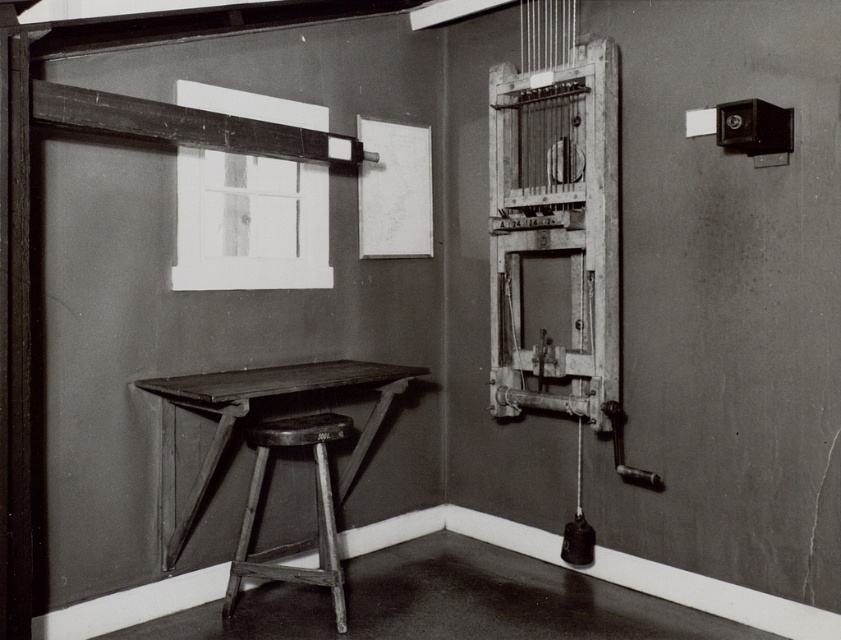
You are setting up a new light fixture in the room. The fixture requires a space that is wider than the wooden table at lower left. Can the white matte window at upper center provide enough width for this requirement?

The white matte window at upper center is thinner than the wooden table at lower left, so it is narrower and cannot provide the required width for the light fixture.